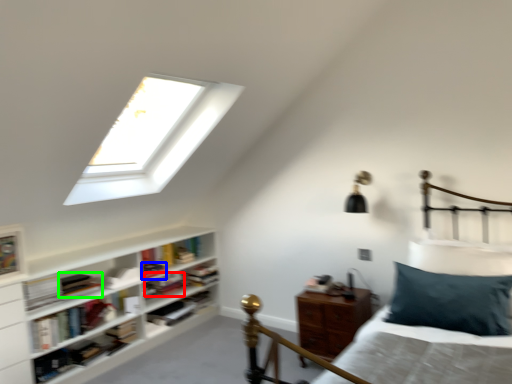
Question: Estimate the real-world distances between objects in this image. Which object is farther from book (highlighted by a red box), book (highlighted by a blue box) or book (highlighted by a green box)?

Choices:
 (A) book
 (B) book

Answer: (B)